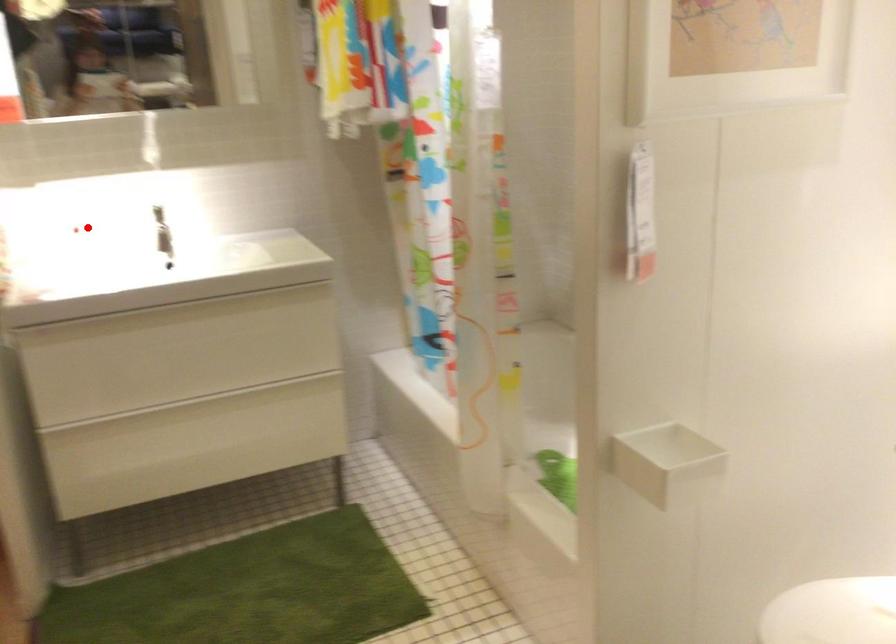
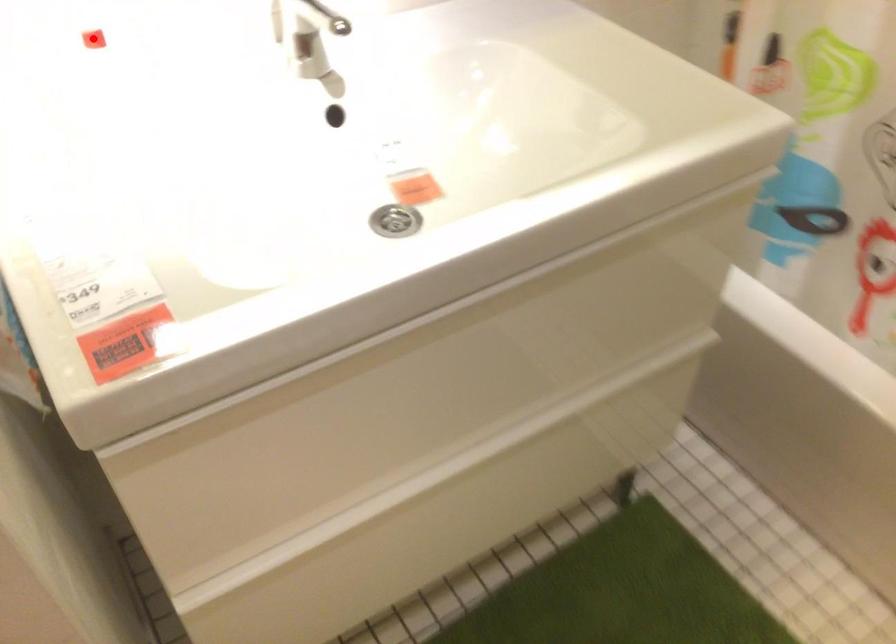
I am providing you with two images of the same scene from different viewpoints. A red point is marked on the first image and another point is marked on the second image. Is the marked point in image1 the same physical position as the marked point in image2?

Yes